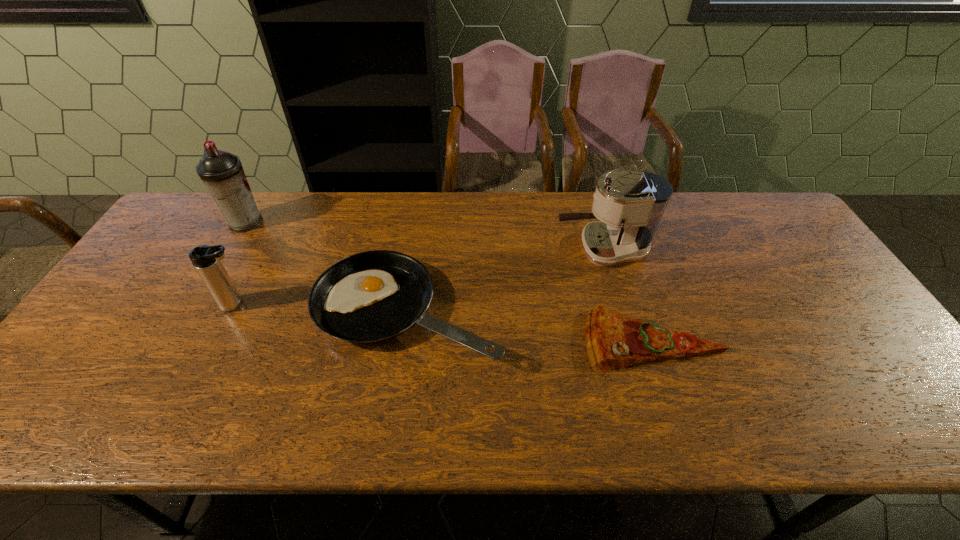
What are the coordinates of `vacant space located on the front-facing side of the coffee maker` in the screenshot? It's located at (531, 249).

Find the location of a particular element. This screenshot has height=540, width=960. vacant space situated 0.120m on the handle side of the thermos bottle is located at coordinates (299, 305).

The width and height of the screenshot is (960, 540). In order to click on free space located on the right of the third object from left to right in this screenshot , I will do `click(570, 313)`.

I want to click on vacant space located 0.330m on the left of the pizza, so click(x=451, y=340).

What are the coordinates of `aerosol can located in the far edge section of the desktop` in the screenshot? It's located at (222, 173).

You are a GUI agent. You are given a task and a screenshot of the screen. Output one action in this format:
    pyautogui.click(x=<x>, y=<y>)
    Task: Click on the coffee maker present at the far edge
    This screenshot has height=540, width=960.
    Given the screenshot: What is the action you would take?
    (630, 205)

You are a GUI agent. You are given a task and a screenshot of the screen. Output one action in this format:
    pyautogui.click(x=<x>, y=<y>)
    Task: Click on the free point at the far edge
    The width and height of the screenshot is (960, 540).
    Given the screenshot: What is the action you would take?
    pyautogui.click(x=405, y=200)

Where is `free space at the near edge`? The width and height of the screenshot is (960, 540). free space at the near edge is located at coordinates (531, 402).

The image size is (960, 540). Identify the location of vacant area at the left edge. (108, 329).

Find the location of a particular element. This screenshot has width=960, height=540. free space at the right edge of the desktop is located at coordinates (804, 327).